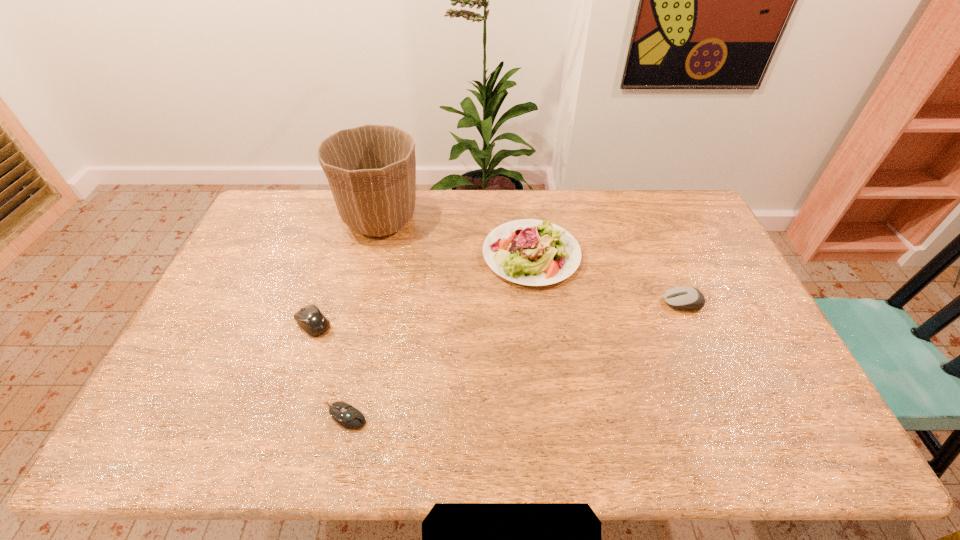
At what (x,y) coordinates should I click in order to perform the action: click on vacant space positioned 0.150m on the wheel side of the rightmost object. Please return your answer as a coordinate pair (x, y). This screenshot has width=960, height=540. Looking at the image, I should click on (613, 303).

Locate an element on the screen. The width and height of the screenshot is (960, 540). vacant region located 0.190m on the wheel side of the rightmost object is located at coordinates (600, 303).

The image size is (960, 540). What are the coordinates of `vacant space located 0.320m on the wheel side of the rightmost object` in the screenshot? It's located at (557, 303).

At what (x,y) coordinates should I click in order to perform the action: click on free space located 0.120m on the left of the shortest computer mouse. Please return your answer as a coordinate pair (x, y). Looking at the image, I should click on (275, 416).

I want to click on flowerpot positioned at the far edge, so click(371, 169).

The height and width of the screenshot is (540, 960). In order to click on salad plate that is at the far edge in this screenshot , I will do `click(531, 252)`.

This screenshot has height=540, width=960. What are the coordinates of `object that is at the near edge` in the screenshot? It's located at (346, 415).

Locate an element on the screen. The image size is (960, 540). object that is at the right edge is located at coordinates (685, 297).

Where is `vacant point at the far edge`? vacant point at the far edge is located at coordinates (506, 192).

At what (x,y) coordinates should I click in order to perform the action: click on free spot at the left edge of the desktop. Please return your answer as a coordinate pair (x, y). The height and width of the screenshot is (540, 960). Looking at the image, I should click on (258, 276).